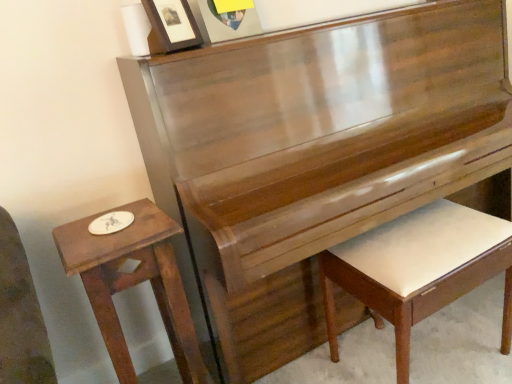
Question: Can you confirm if matte black picture frame at upper center, arranged as the 1th picture frame when viewed from the left, is smaller than matte wooden picture frame at upper center, the second picture frame viewed from the left?

Choices:
 (A) yes
 (B) no

Answer: (A)

Question: Considering the relative sizes of matte black picture frame at upper center, arranged as the 1th picture frame when viewed from the left, and matte wooden picture frame at upper center, the second picture frame viewed from the left, in the image provided, is matte black picture frame at upper center, arranged as the 1th picture frame when viewed from the left, thinner than matte wooden picture frame at upper center, the second picture frame viewed from the left,?

Choices:
 (A) no
 (B) yes

Answer: (A)

Question: Are matte black picture frame at upper center, arranged as the 1th picture frame when viewed from the left, and matte wooden picture frame at upper center, placed as the first picture frame when sorted from right to left, making contact?

Choices:
 (A) yes
 (B) no

Answer: (B)

Question: Is matte wooden picture frame at upper center, the second picture frame viewed from the left, at the back of matte black picture frame at upper center, placed as the second picture frame when sorted from right to left?

Choices:
 (A) yes
 (B) no

Answer: (B)

Question: Are matte black picture frame at upper center, placed as the second picture frame when sorted from right to left, and matte wooden picture frame at upper center, the second picture frame viewed from the left, far apart?

Choices:
 (A) yes
 (B) no

Answer: (B)

Question: Is matte black picture frame at upper center, placed as the second picture frame when sorted from right to left, taller than matte wooden picture frame at upper center, placed as the first picture frame when sorted from right to left?

Choices:
 (A) yes
 (B) no

Answer: (B)

Question: Considering the relative positions of white leather piano bench at lower right and matte black picture frame at upper center, placed as the second picture frame when sorted from right to left, in the image provided, is white leather piano bench at lower right to the right of matte black picture frame at upper center, placed as the second picture frame when sorted from right to left, from the viewer's perspective?

Choices:
 (A) no
 (B) yes

Answer: (B)

Question: Is matte black picture frame at upper center, arranged as the 1th picture frame when viewed from the left, inside white leather piano bench at lower right?

Choices:
 (A) no
 (B) yes

Answer: (A)

Question: Is white leather piano bench at lower right smaller than matte black picture frame at upper center, arranged as the 1th picture frame when viewed from the left?

Choices:
 (A) yes
 (B) no

Answer: (B)

Question: Can you confirm if white leather piano bench at lower right is positioned to the left of matte black picture frame at upper center, arranged as the 1th picture frame when viewed from the left?

Choices:
 (A) yes
 (B) no

Answer: (B)

Question: Is white leather piano bench at lower right facing away from matte black picture frame at upper center, placed as the second picture frame when sorted from right to left?

Choices:
 (A) no
 (B) yes

Answer: (A)

Question: Considering the relative sizes of white leather piano bench at lower right and matte black picture frame at upper center, placed as the second picture frame when sorted from right to left, in the image provided, is white leather piano bench at lower right taller than matte black picture frame at upper center, placed as the second picture frame when sorted from right to left,?

Choices:
 (A) no
 (B) yes

Answer: (B)

Question: Could you tell me if matte wooden picture frame at upper center, placed as the first picture frame when sorted from right to left, is facing white leather piano bench at lower right?

Choices:
 (A) no
 (B) yes

Answer: (A)